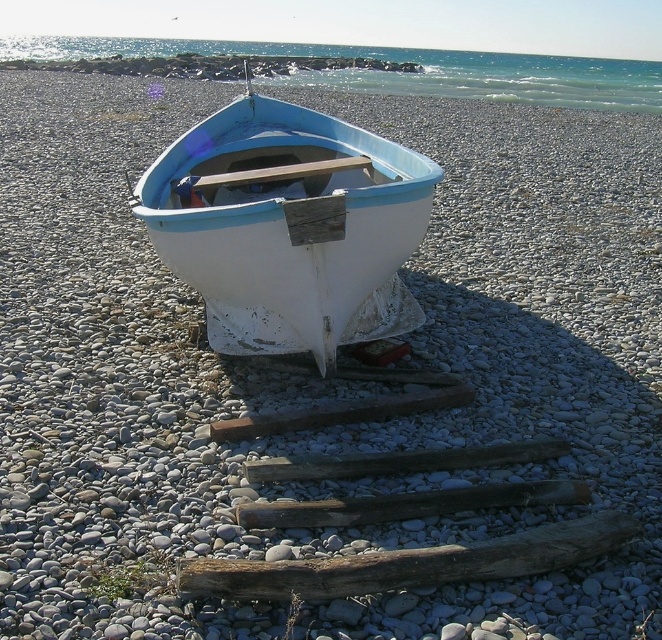
Does point (365, 250) lie behind point (232, 566)?

Yes, it is.

In the scene shown: Is white matte boat at center positioned at the back of weathered wood log at center?

Yes, white matte boat at center is further from the viewer.

Between point (307, 262) and point (565, 548), which one is positioned in front?

Point (565, 548) is more forward.

Locate an element on the screen. This screenshot has width=662, height=640. white matte boat at center is located at coordinates (289, 227).